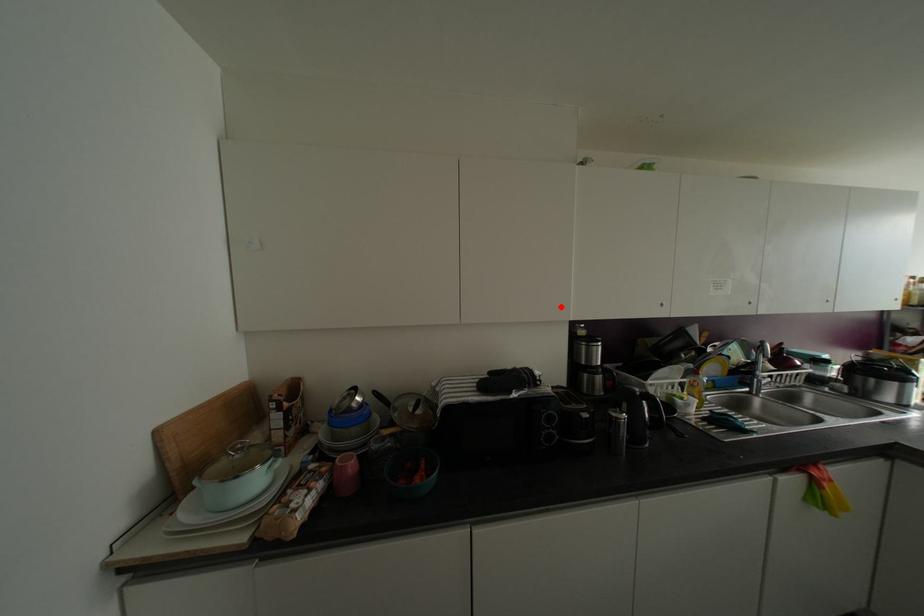
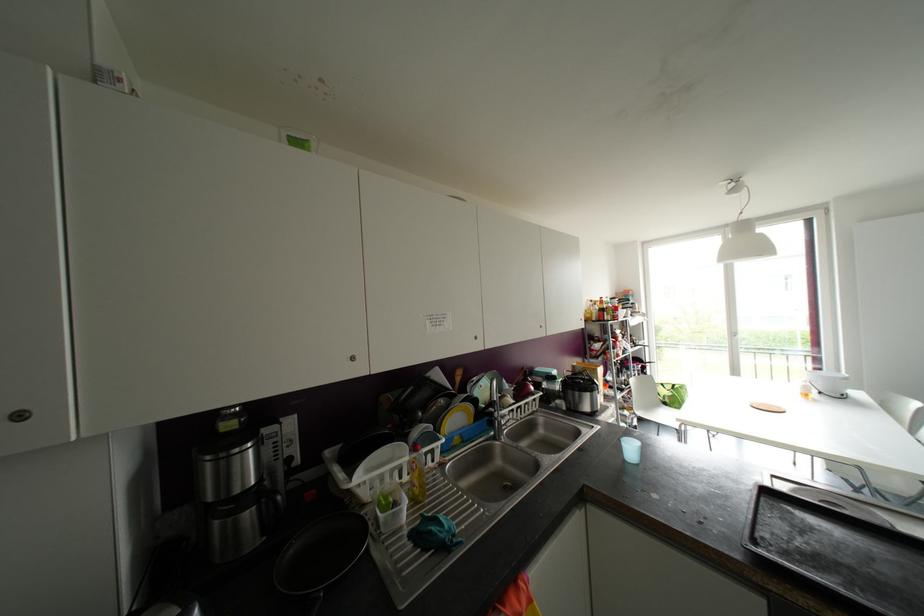
The point at the highlighted location is marked in the first image. Where is the corresponding point in the second image?

(19, 416)